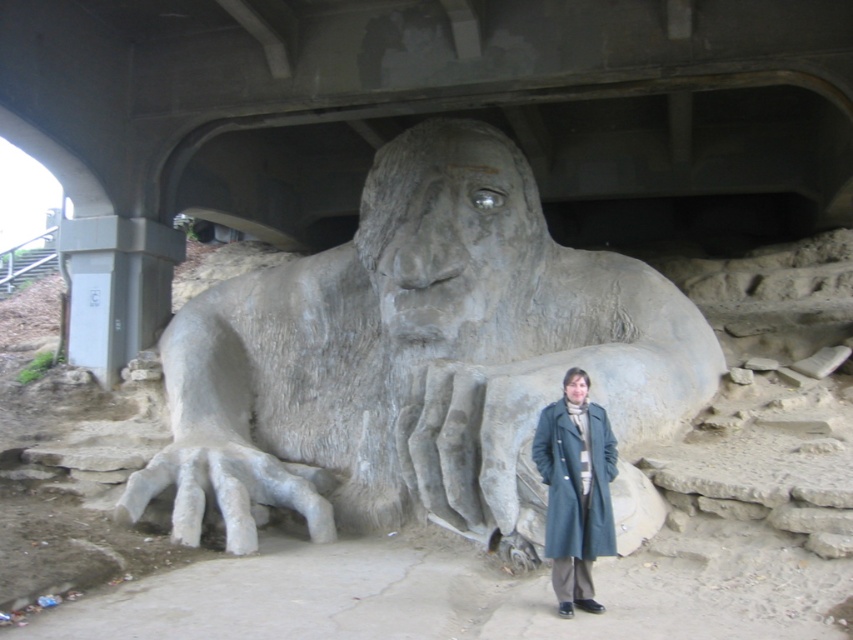
You are an art student who wants to sketch the gray stone statue at center and the matte gray coat at lower right. Which object should you focus on first if you want to draw the taller object first?

The gray stone statue at center is taller than the matte gray coat at lower right, so you should focus on drawing the gray stone statue at center first.

You are a tourist standing at the entrance of the bridge and want to take a photo of the gray stone statue at center. However, there is a matte gray coat at lower right in the way. Can you move the coat to get a clear shot of the statue?

The matte gray coat at lower right is behind the gray stone statue at center, so moving it won not block the statue. You can take the photo without moving the coat.